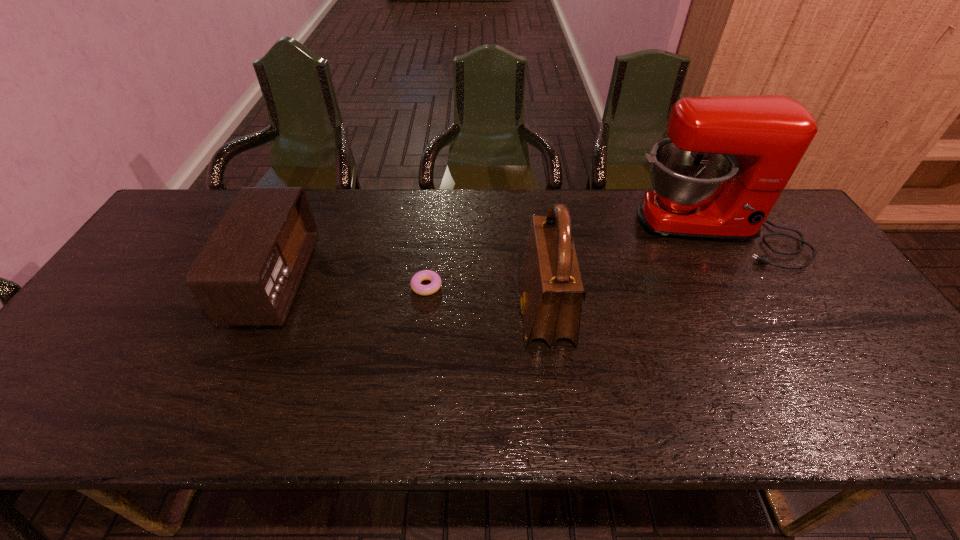
The image size is (960, 540). In the image, there is a desktop. Find the location of `vacant area at the far right corner`. vacant area at the far right corner is located at coordinates (777, 231).

Where is `blank region between the third tallest object and the rightmost object`? blank region between the third tallest object and the rightmost object is located at coordinates (494, 257).

Find the location of a particular element. unoccupied area between the third object from left to right and the rightmost object is located at coordinates (629, 273).

I want to click on blank region between the second tallest object and the tallest object, so click(x=629, y=273).

Image resolution: width=960 pixels, height=540 pixels. In order to click on empty space that is in between the second object from right to left and the doughnut in this screenshot , I will do `click(486, 299)`.

Identify the location of free spot between the doughnut and the leftmost object. (351, 284).

Find the location of `free space between the doughnut and the leftmost object`. free space between the doughnut and the leftmost object is located at coordinates (351, 284).

You are a GUI agent. You are given a task and a screenshot of the screen. Output one action in this format:
    pyautogui.click(x=<x>, y=<y>)
    Task: Click on the empty space between the kitchen mixer and the second tallest object
    The image size is (960, 540).
    Given the screenshot: What is the action you would take?
    pyautogui.click(x=629, y=273)

The height and width of the screenshot is (540, 960). I want to click on empty location between the kitchen mixer and the radio receiver, so click(x=494, y=257).

Identify the location of object that is the closest to the third object from left to right. (415, 283).